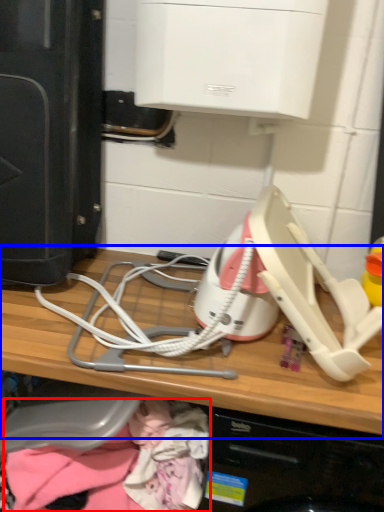
Question: Among these objects, which one is nearest to the camera, clothing (highlighted by a red box) or computer (highlighted by a blue box)?

Choices:
 (A) clothing
 (B) computer

Answer: (B)